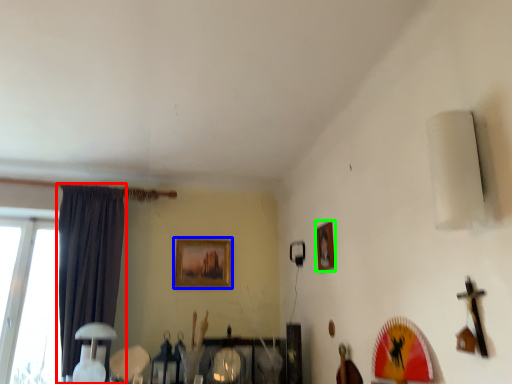
Question: Based on their relative distances, which object is nearer to curtain (highlighted by a red box)? Choose from picture frame (highlighted by a blue box) and picture frame (highlighted by a green box).

Choices:
 (A) picture frame
 (B) picture frame

Answer: (A)